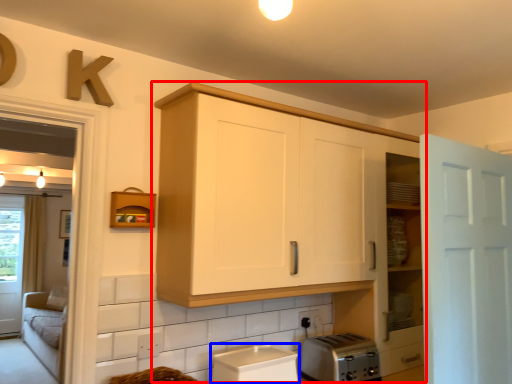
Question: Among these objects, which one is farthest to the camera, cabinetry (highlighted by a red box) or appliance (highlighted by a blue box)?

Choices:
 (A) cabinetry
 (B) appliance

Answer: (B)